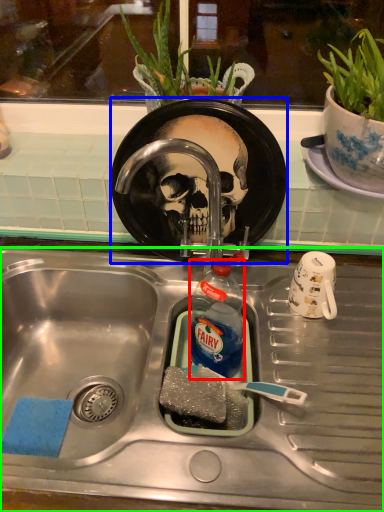
Question: Which object is positioned closest to bottle (highlighted by a red box)? Select from plate (highlighted by a blue box) and sink (highlighted by a green box).

Choices:
 (A) plate
 (B) sink

Answer: (B)